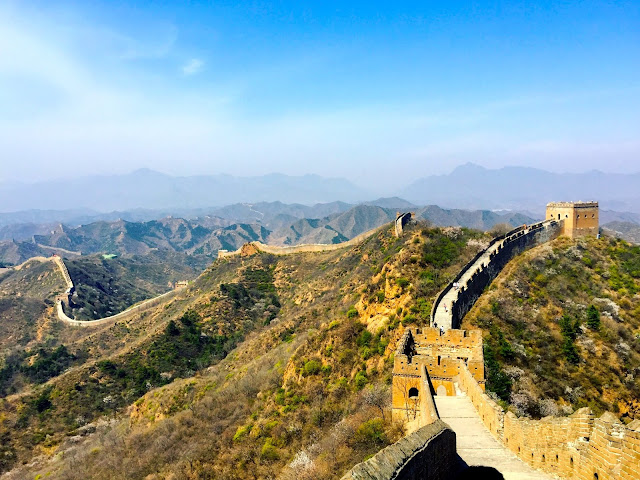
Identify the location of wall ledge. (427, 393), (475, 387).